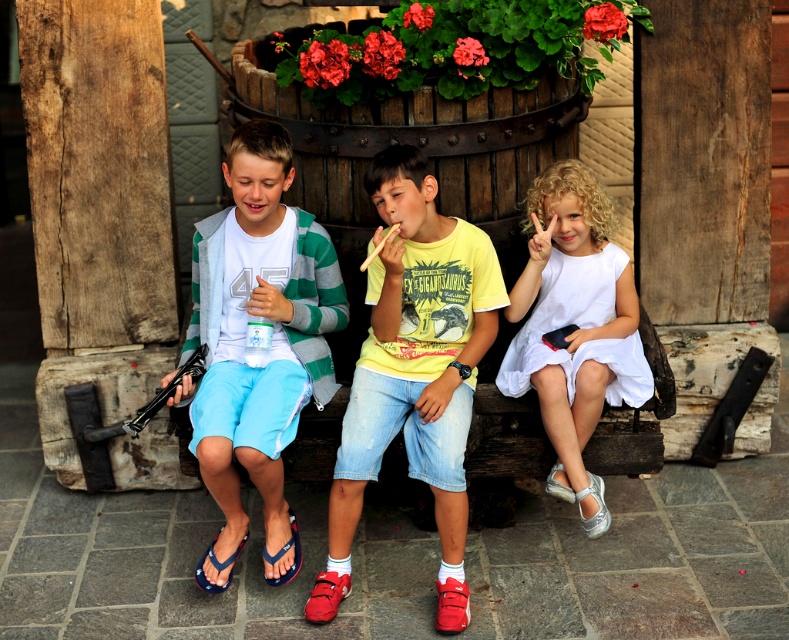
Question: Which of these objects is positioned farthest from the yellow cotton shirt at center?

Choices:
 (A) red suede sandal at lower center
 (B) white satin dress at right
 (C) white cotton shirt at center
 (D) blue fabric sandal at lower left

Answer: (D)

Question: Considering the relative positions of yellow cotton shirt at center and blue fabric sandal at lower left in the image provided, where is yellow cotton shirt at center located with respect to blue fabric sandal at lower left?

Choices:
 (A) left
 (B) right

Answer: (B)

Question: Is red suede sandal at lower center below blue fabric sandal at lower center?

Choices:
 (A) no
 (B) yes

Answer: (B)

Question: Is white cotton shirt at center above blue fabric sandal at lower left?

Choices:
 (A) yes
 (B) no

Answer: (A)

Question: Which point appears farthest from the camera in this image?

Choices:
 (A) (331, 531)
 (B) (350, 579)

Answer: (B)

Question: Which object appears farthest from the camera in this image?

Choices:
 (A) blue fabric sandal at lower center
 (B) yellow cotton shirt at center
 (C) white satin dress at right

Answer: (A)